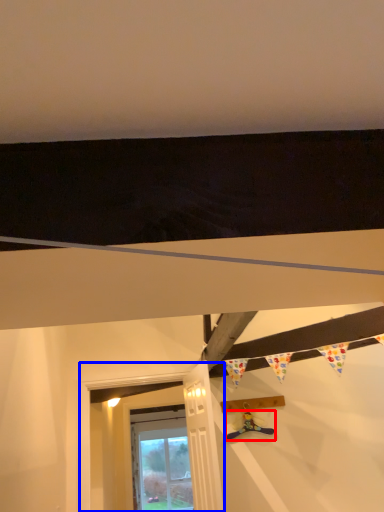
Question: Which of the following is the closest to the observer, toy (highlighted by a red box) or window frame (highlighted by a blue box)?

Choices:
 (A) toy
 (B) window frame

Answer: (B)